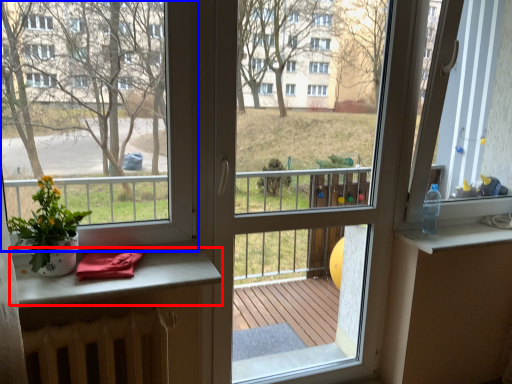
Question: Which point is further to the camera, table (highlighted by a red box) or window (highlighted by a blue box)?

Choices:
 (A) table
 (B) window

Answer: (A)